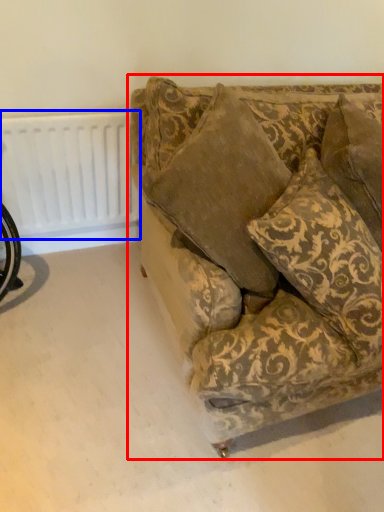
Question: Among these objects, which one is nearest to the camera, studio couch (highlighted by a red box) or radiator (highlighted by a blue box)?

Choices:
 (A) studio couch
 (B) radiator

Answer: (A)